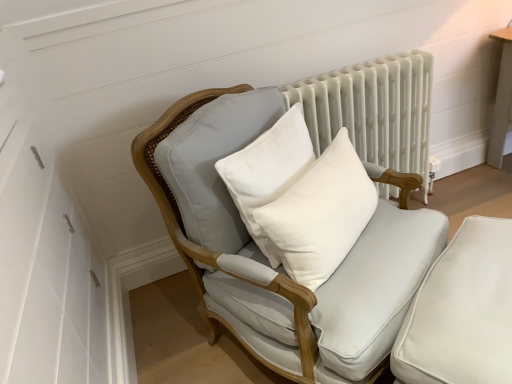
Question: From a real-world perspective, is white painted radiator at upper center physically located above or below white fabric chair at center?

Choices:
 (A) below
 (B) above

Answer: (A)

Question: Considering the positions of white painted radiator at upper center and white fabric chair at center in the image, is white painted radiator at upper center wider or thinner than white fabric chair at center?

Choices:
 (A) wide
 (B) thin

Answer: (B)

Question: Estimate the real-world distances between objects in this image. Which object is farther from the white fabric chair at center?

Choices:
 (A) white leather swivel chair at lower right
 (B) white cotton pillow at center, the first pillow viewed from the left
 (C) white painted radiator at upper center
 (D) white cotton pillow at center, which is the second pillow in left-to-right order

Answer: (C)

Question: Estimate the real-world distances between objects in this image. Which object is closer to the white cotton pillow at center, the first pillow viewed from the left?

Choices:
 (A) white cotton pillow at center, which is the 1th pillow from right to left
 (B) white painted radiator at upper center
 (C) white leather swivel chair at lower right
 (D) white fabric chair at center

Answer: (A)